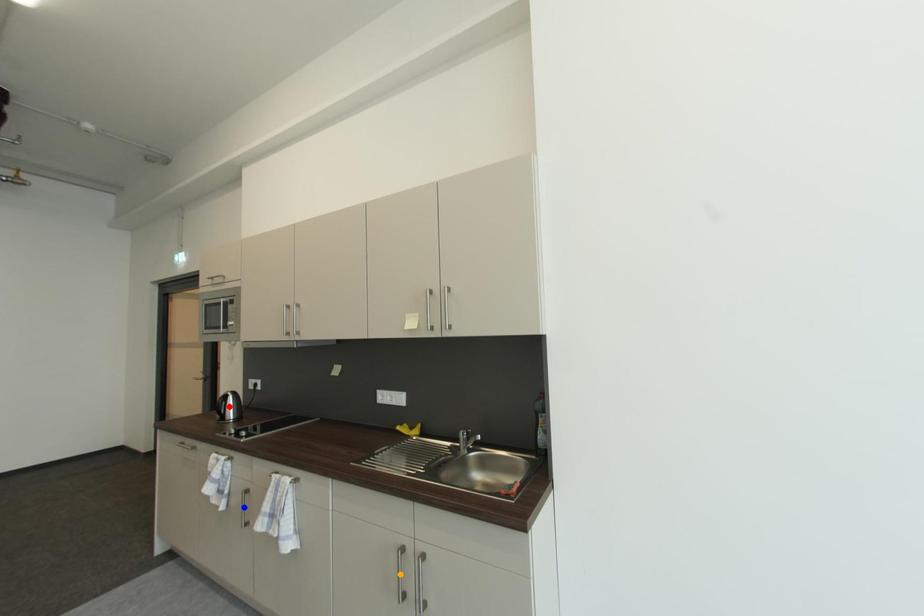
Based on the photo, order these from nearest to farthest:
- orange point
- blue point
- red point

orange point
blue point
red point